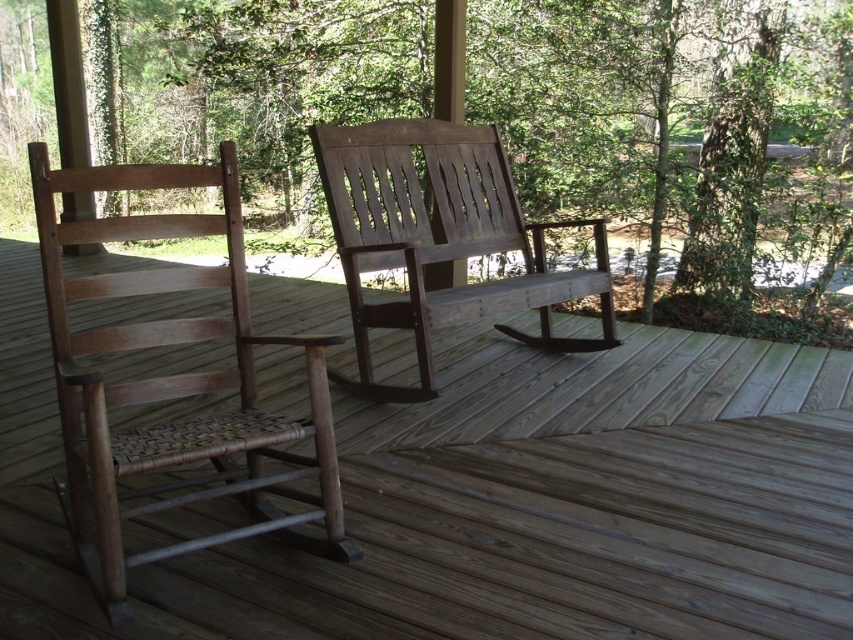
Question: Which point appears farthest from the camera in this image?

Choices:
 (A) (351, 161)
 (B) (111, 182)

Answer: (A)

Question: Which point is closer to the camera taking this photo?

Choices:
 (A) (440, 422)
 (B) (253, 344)
 (C) (384, 230)

Answer: (B)

Question: Is wooden deck at center smaller than wooden woven seat at left?

Choices:
 (A) yes
 (B) no

Answer: (B)

Question: Which object is the closest to the wooden deck at center?

Choices:
 (A) weathered wood rocking chair at center
 (B) wooden woven seat at left

Answer: (B)

Question: Is wooden woven seat at left bigger than weathered wood rocking chair at center?

Choices:
 (A) yes
 (B) no

Answer: (B)

Question: Does wooden woven seat at left appear on the right side of weathered wood rocking chair at center?

Choices:
 (A) yes
 (B) no

Answer: (B)